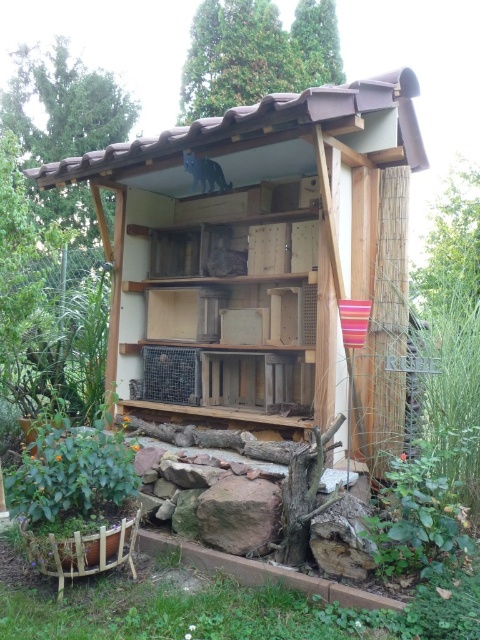
Describe the element at coordinates (264, 260) in the screenshot. The width and height of the screenshot is (480, 640). I see `wooden birdhouse at center` at that location.

At what (x,y) coordinates should I click in order to perform the action: click on wooden birdhouse at center. Please return your answer as a coordinate pair (x, y). Looking at the image, I should click on (264, 260).

Is point (319, 280) positioned in front of point (224, 493)?

No, (319, 280) is behind (224, 493).

Find the location of `wooden birdhouse at center`. wooden birdhouse at center is located at coordinates (264, 260).